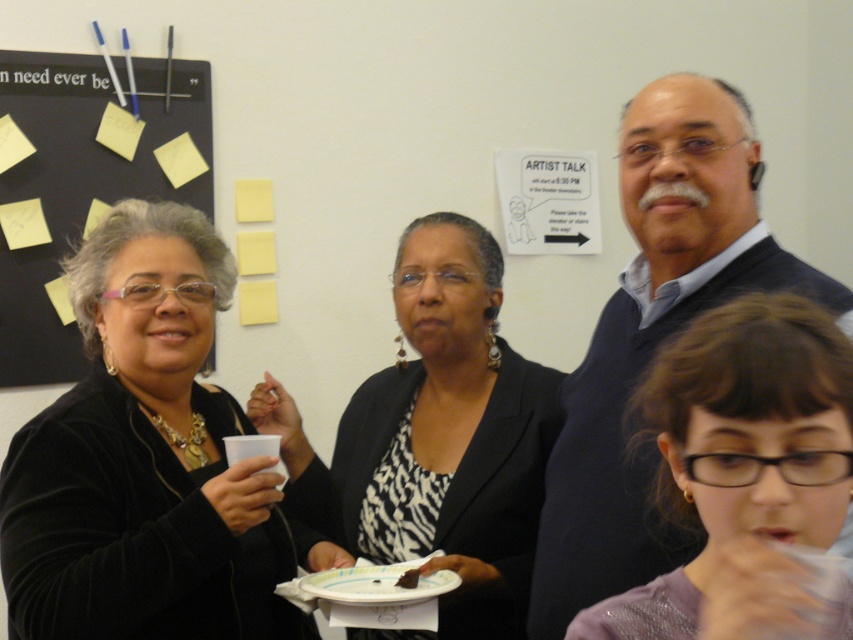
You are planning to hang a new poster that is 1 meter tall on the wall. Based on the scene, which object between the black matte board at upper left and the white paper plate at lower center would be more suitable to place the poster above without overlapping?

The black matte board at upper left is much taller than the white paper plate at lower center, so placing the poster above the black matte board at upper left would be more suitable since it has enough vertical space to accommodate the 1 meter tall poster without overlapping.

You are a photographer taking a picture of the scene described. You notice the dark blue sweater at upper right and the chocolate cake at center. Which object is closer to the camera?

The dark blue sweater at upper right is positioned over the chocolate cake at center, so it is closer to the camera.

You are planning to place a white paper plate at lower center on top of the black matte board at upper left. Will the plate fit entirely on the board?

The black matte board at upper left might be wider than white paper plate at lower center, so there is a possibility that the plate will fit, but it is uncertain due to the comparative size mentioned as a possibility.